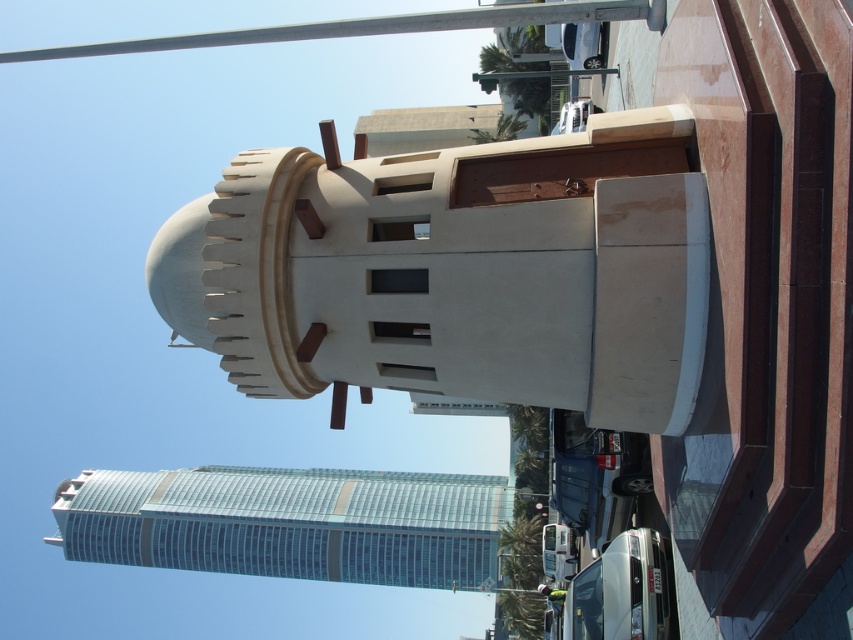
Question: Which point is farther to the camera?

Choices:
 (A) (167, 45)
 (B) (601, 589)

Answer: (A)

Question: Can you confirm if metallic pole at upper center is wider than white glossy bus at lower center?

Choices:
 (A) no
 (B) yes

Answer: (B)

Question: Can you confirm if metallic pole at upper center is wider than white glossy bus at lower center?

Choices:
 (A) no
 (B) yes

Answer: (B)

Question: Which point is farther to the camera?

Choices:
 (A) (438, 28)
 (B) (608, 589)

Answer: (B)

Question: Which of the following is the closest to the observer?

Choices:
 (A) (369, 33)
 (B) (628, 605)

Answer: (A)

Question: Can you confirm if metallic pole at upper center is thinner than white glossy bus at lower center?

Choices:
 (A) yes
 (B) no

Answer: (B)